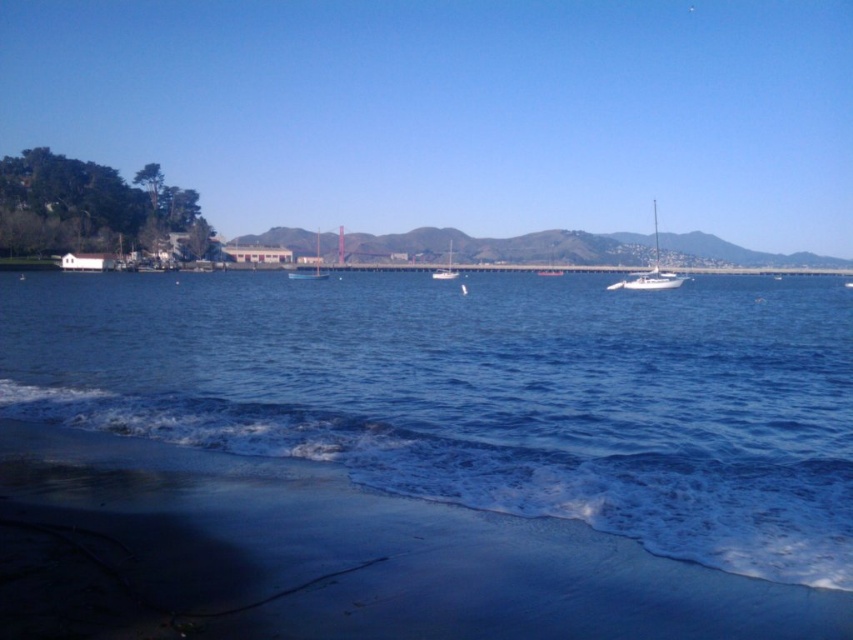
Question: Does sandy beach at lower left come behind white glossy sailboat at right?

Choices:
 (A) yes
 (B) no

Answer: (B)

Question: Which of these objects is positioned closest to the sandy beach at lower left?

Choices:
 (A) blue plastic boat at center
 (B) blue liquid water at lower center

Answer: (B)

Question: Considering the relative positions of blue liquid water at lower center and sandy beach at lower left in the image provided, where is blue liquid water at lower center located with respect to sandy beach at lower left?

Choices:
 (A) above
 (B) below

Answer: (A)

Question: Where is blue liquid water at lower center located in relation to blue plastic boat at center in the image?

Choices:
 (A) above
 (B) below

Answer: (B)

Question: Among these objects, which one is farthest from the camera?

Choices:
 (A) metallic sailboat at center
 (B) blue plastic boat at center
 (C) white glossy sailboat at right

Answer: (A)

Question: Among these points, which one is farthest from the camera?

Choices:
 (A) coord(440,275)
 (B) coord(318,272)
 (C) coord(288,273)
 (D) coord(831,298)

Answer: (B)